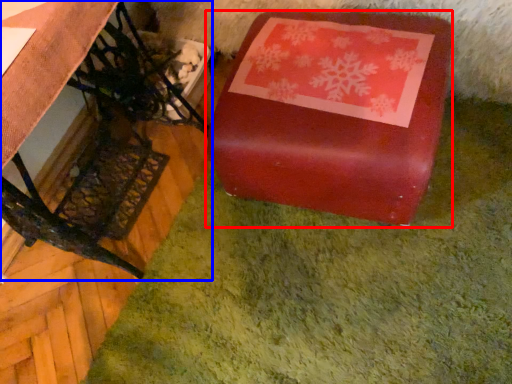
Question: Among these objects, which one is nearest to the camera, table (highlighted by a red box) or furniture (highlighted by a blue box)?

Choices:
 (A) table
 (B) furniture

Answer: (B)